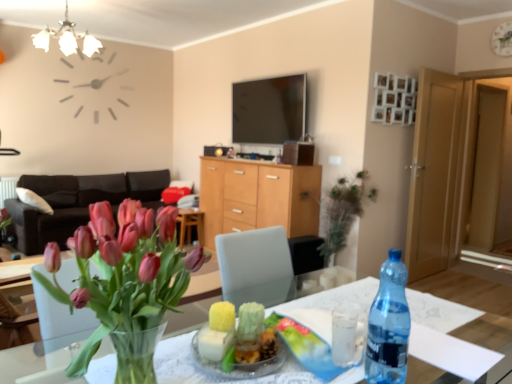
Question: Is light brown wooden door at right, the 2th glass door viewed from the right, taller or shorter than white glass chandelier at upper left?

Choices:
 (A) short
 (B) tall

Answer: (B)

Question: Considering the positions of point (436, 147) and point (80, 34), is point (436, 147) closer or farther from the camera than point (80, 34)?

Choices:
 (A) closer
 (B) farther

Answer: (A)

Question: Which is farther from the white glass chandelier at upper left?

Choices:
 (A) dark brown leather couch at left
 (B) transparent plastic bottle at table right
 (C) white matte clock at upper center
 (D) clear glass vase at center
 (E) matte black phone at center

Answer: (B)

Question: Which of these objects is positioned closest to the green leafy plant at center?

Choices:
 (A) pink glass vase at lower left
 (B) white glass chandelier at upper left
 (C) light brown wooden door at right, marked as the first glass door in a left-to-right arrangement
 (D) wooden cabinet at center
 (E) wooden side table at center

Answer: (D)